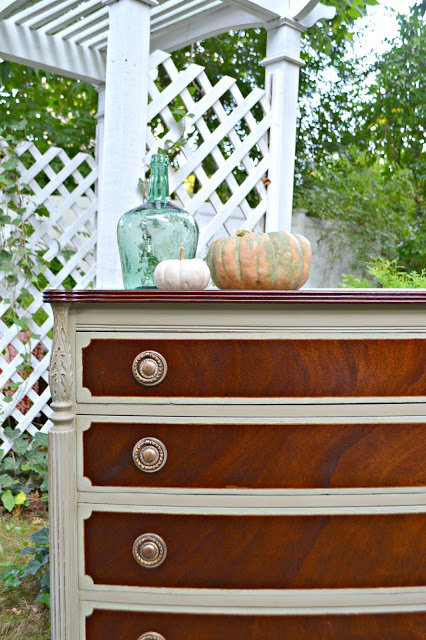
Locate an element on the screen. The height and width of the screenshot is (640, 426). drawers is located at coordinates (210, 368), (206, 548), (213, 454), (219, 625).